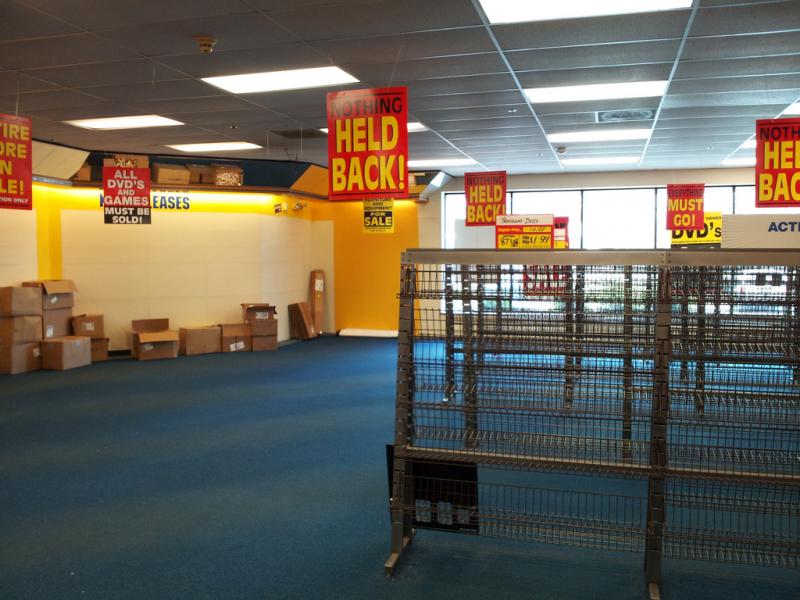
Locate an element on the screen. This screenshot has height=600, width=800. orange wall is located at coordinates (372, 291).